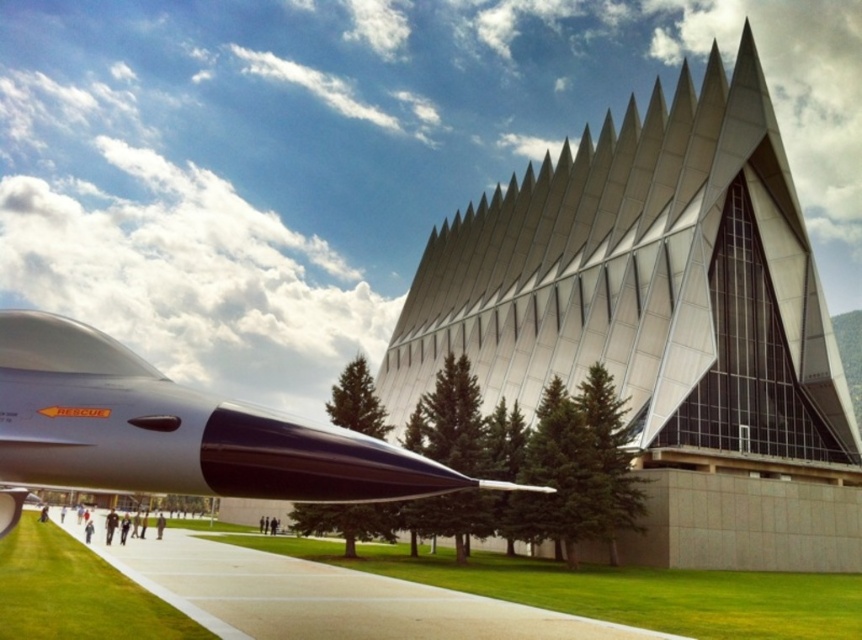
Question: Which point is closer to the camera taking this photo?

Choices:
 (A) (164, 419)
 (B) (829, 486)

Answer: (A)

Question: Which point is farther to the camera?

Choices:
 (A) glossy metallic missile at lower left
 (B) metallic silver building at center

Answer: (B)

Question: Can you confirm if metallic silver building at center is smaller than glossy metallic missile at lower left?

Choices:
 (A) no
 (B) yes

Answer: (A)

Question: Which point is closer to the camera?

Choices:
 (A) (672, 403)
 (B) (284, 468)

Answer: (B)

Question: Does metallic silver building at center have a lesser width compared to glossy metallic missile at lower left?

Choices:
 (A) yes
 (B) no

Answer: (B)

Question: Observing the image, what is the correct spatial positioning of metallic silver building at center in reference to glossy metallic missile at lower left?

Choices:
 (A) right
 (B) left

Answer: (A)